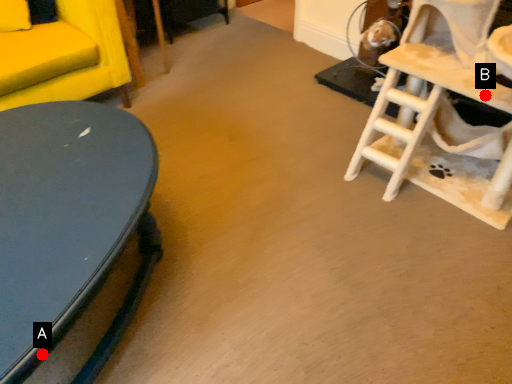
Question: Two points are circled on the image, labeled by A and B beside each circle. Which point appears closest to the camera in this image?

Choices:
 (A) A is closer
 (B) B is closer

Answer: (A)